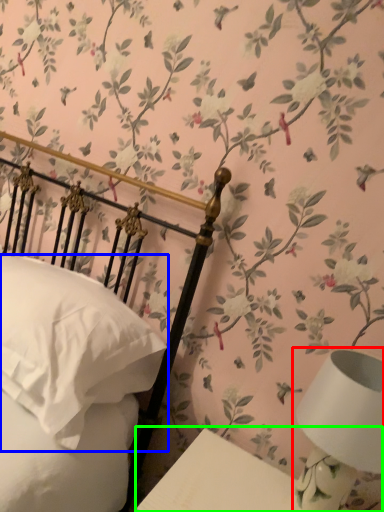
Question: Estimate the real-world distances between objects in this image. Which object is farther from table lamp (highlighted by a red box), pillow (highlighted by a blue box) or table (highlighted by a green box)?

Choices:
 (A) pillow
 (B) table

Answer: (A)